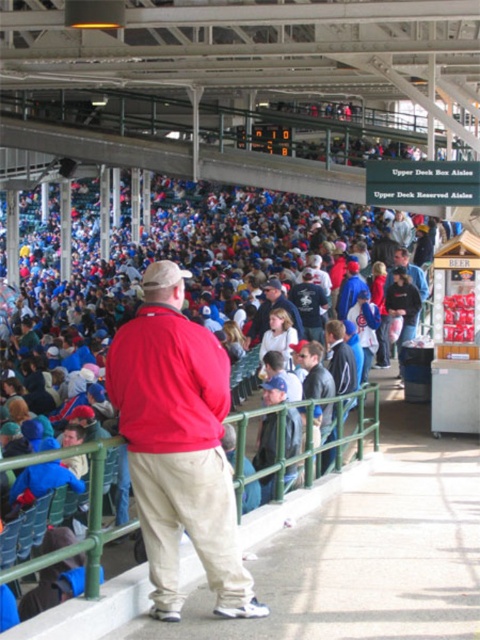
Question: Does matte red jacket at center have a lesser width compared to blue denim jeans at center?

Choices:
 (A) yes
 (B) no

Answer: (B)

Question: Is the position of blue denim jeans at center more distant than that of dark gray jacket at center?

Choices:
 (A) no
 (B) yes

Answer: (A)

Question: Which object is positioned farthest from the matte red jacket at center?

Choices:
 (A) dark gray jacket at center
 (B) green metal railing at center
 (C) blue denim jeans at center

Answer: (A)

Question: Which is farther from the green metal railing at center?

Choices:
 (A) matte red jacket at center
 (B) dark gray jacket at center
 (C) blue denim jeans at center

Answer: (B)

Question: Is matte red jacket at center behind blue denim jeans at center?

Choices:
 (A) yes
 (B) no

Answer: (B)

Question: Which point appears farthest from the camera in this image?

Choices:
 (A) (264, 416)
 (B) (324, 452)
 (C) (228, 376)
 (D) (116, 588)

Answer: (B)